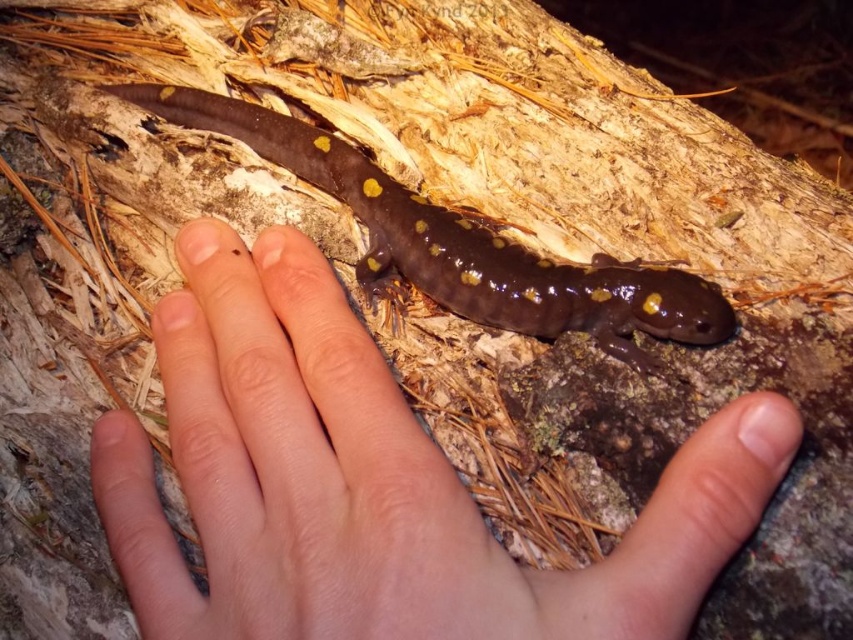
Does smooth skin hand at center appear on the left side of shiny brown salamander at center?

In fact, smooth skin hand at center is to the right of shiny brown salamander at center.

What do you see at coordinates (374, 483) in the screenshot? This screenshot has width=853, height=640. I see `smooth skin hand at center` at bounding box center [374, 483].

Who is more distant from viewer, (334,557) or (439,209)?

Positioned behind is point (439,209).

Where is `smooth skin hand at center`? This screenshot has height=640, width=853. smooth skin hand at center is located at coordinates (374, 483).